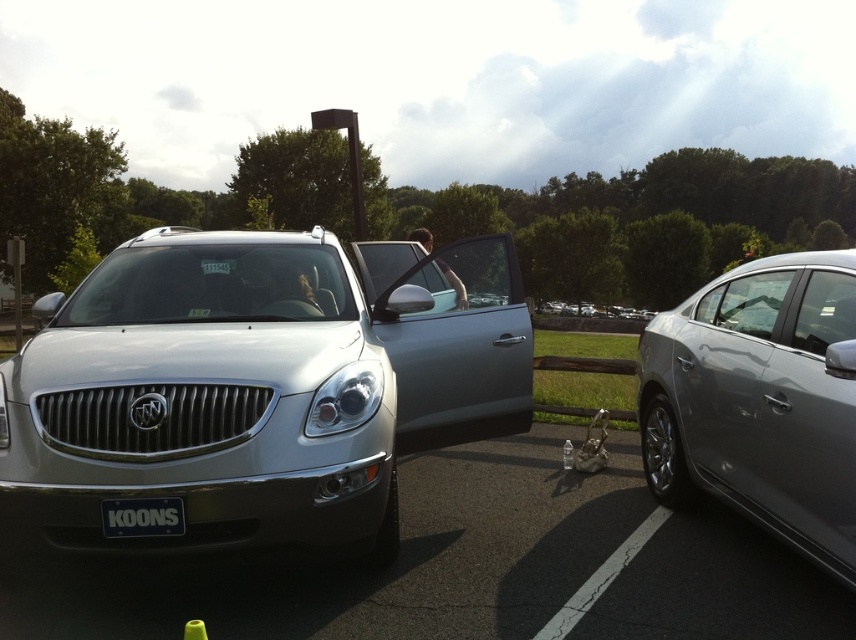
Question: Is satin silver suv at center further to camera compared to satin silver sedan at right?

Choices:
 (A) yes
 (B) no

Answer: (A)

Question: From the image, what is the correct spatial relationship of satin silver suv at center in relation to satin silver sedan at right?

Choices:
 (A) above
 (B) below

Answer: (A)

Question: Based on their relative distances, which object is farther from the satin silver sedan at right?

Choices:
 (A) black matte license plate at center
 (B) satin silver suv at center

Answer: (A)

Question: Is the position of satin silver sedan at right less distant than that of black matte license plate at center?

Choices:
 (A) yes
 (B) no

Answer: (A)

Question: Estimate the real-world distances between objects in this image. Which object is closer to the satin silver suv at center?

Choices:
 (A) satin silver sedan at right
 (B) black matte license plate at center

Answer: (B)

Question: Which of the following is the closest to the observer?

Choices:
 (A) (224, 422)
 (B) (694, 355)
 (C) (155, 529)

Answer: (C)